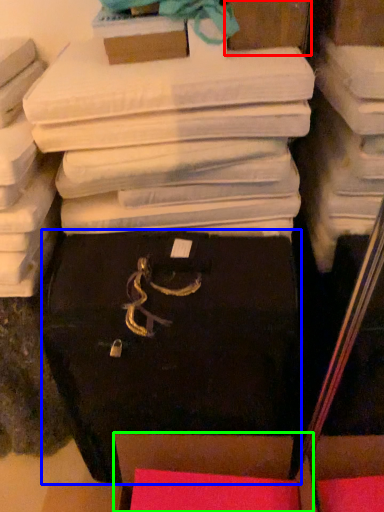
Question: Which object is the closest to the storage box (highlighted by a red box)? Choose among these: storage box (highlighted by a blue box) or storage box (highlighted by a green box).

Choices:
 (A) storage box
 (B) storage box

Answer: (A)